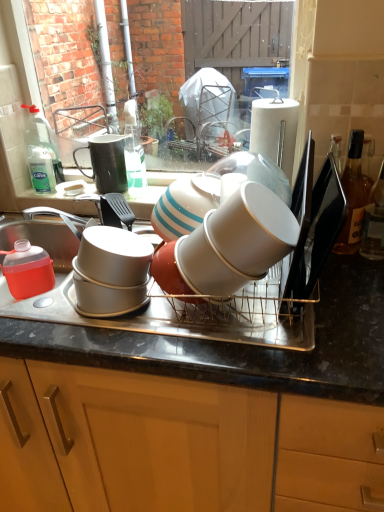
Question: From the image's perspective, does white glossy cup at center, which appears as the first tableware when viewed from the front, appear lower than metallic gray tray at center?

Choices:
 (A) yes
 (B) no

Answer: (B)

Question: Is white glossy cup at center, the 4th tableware from the back, directly adjacent to metallic gray tray at center?

Choices:
 (A) no
 (B) yes

Answer: (A)

Question: From the image's perspective, would you say white glossy cup at center, the 4th tableware from the back, is positioned over metallic gray tray at center?

Choices:
 (A) no
 (B) yes

Answer: (B)

Question: Would you say white glossy cup at center, which is counted as the 4th tableware, starting from the left, is outside metallic gray tray at center?

Choices:
 (A) yes
 (B) no

Answer: (A)

Question: Is white glossy cup at center, which appears as the first tableware when viewed from the front, aimed at metallic gray tray at center?

Choices:
 (A) yes
 (B) no

Answer: (B)

Question: Is white glossy cup at center, the 4th tableware from the back, not close to metallic gray tray at center?

Choices:
 (A) no
 (B) yes

Answer: (A)

Question: Considering the relative sizes of brown glass bottle at right, positioned as the second bottle in right-to-left order, and white glossy cup at center, the 2th tableware from the right, in the image provided, is brown glass bottle at right, positioned as the second bottle in right-to-left order, taller than white glossy cup at center, the 2th tableware from the right,?

Choices:
 (A) no
 (B) yes

Answer: (B)

Question: Can you confirm if brown glass bottle at right, positioned as the second bottle in right-to-left order, is positioned to the right of white glossy cup at center, positioned as the second tableware in front-to-back order?

Choices:
 (A) yes
 (B) no

Answer: (A)

Question: Does brown glass bottle at right, positioned as the second bottle in right-to-left order, lie in front of white glossy cup at center, the 3th tableware in the back-to-front sequence?

Choices:
 (A) yes
 (B) no

Answer: (B)

Question: Considering the relative sizes of brown glass bottle at right, which ranks as the 1th bottle in left-to-right order, and white glossy cup at center, the 2th tableware from the right, in the image provided, is brown glass bottle at right, which ranks as the 1th bottle in left-to-right order, wider than white glossy cup at center, the 2th tableware from the right,?

Choices:
 (A) yes
 (B) no

Answer: (B)

Question: Are brown glass bottle at right, positioned as the second bottle in right-to-left order, and white glossy cup at center, positioned as the second tableware in front-to-back order, beside each other?

Choices:
 (A) no
 (B) yes

Answer: (A)

Question: Is brown glass bottle at right, positioned as the second bottle in right-to-left order, at the left side of white glossy cup at center, the 3th tableware in the back-to-front sequence?

Choices:
 (A) no
 (B) yes

Answer: (A)

Question: Could you tell me if translucent plastic jug at left, which is the second tableware from back to front, is turned towards white glossy cup at center, the 4th tableware from the back?

Choices:
 (A) no
 (B) yes

Answer: (A)